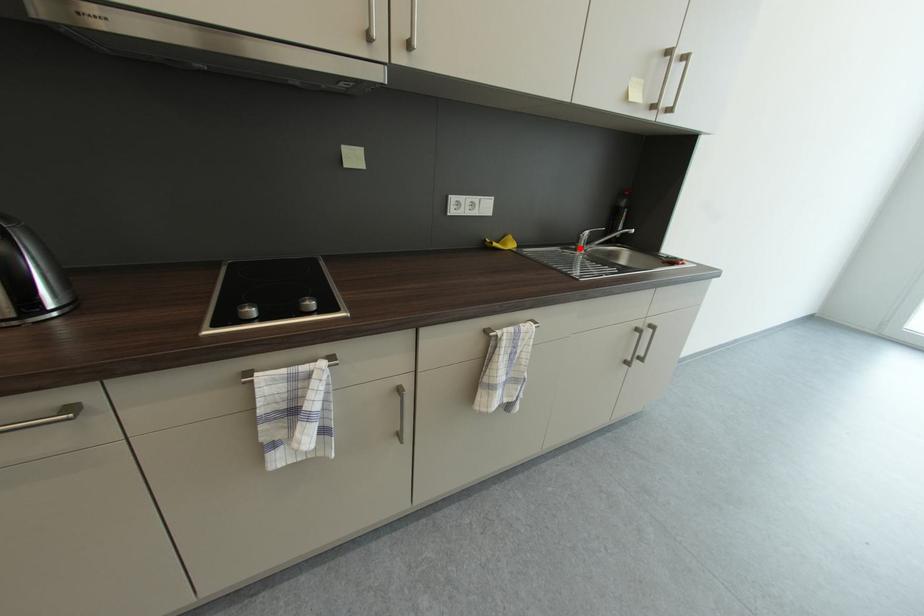
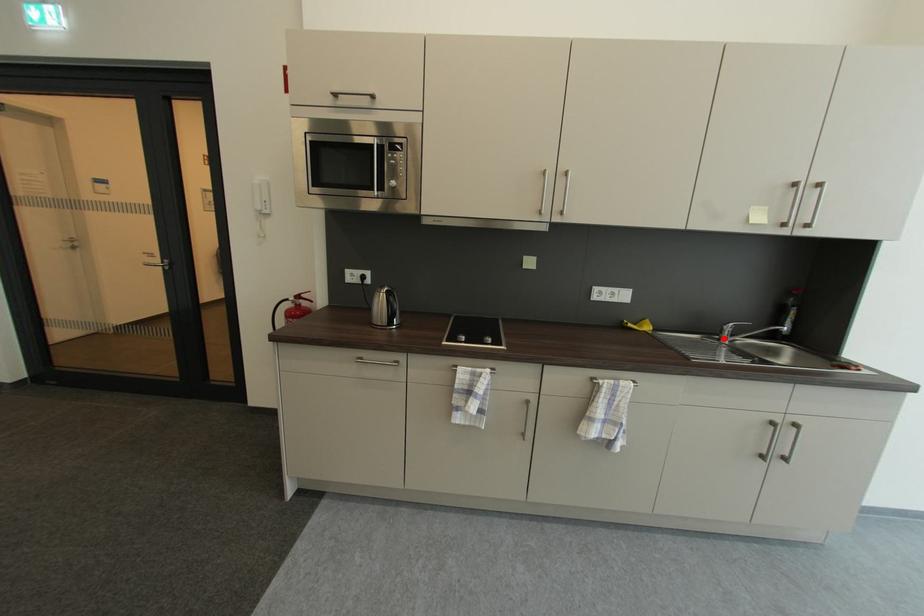
I am providing you with two images of the same scene from different viewpoints. A red point is marked on the first image and another point is marked on the second image. Is the red point in image1 aligned with the point shown in image2?

Yes